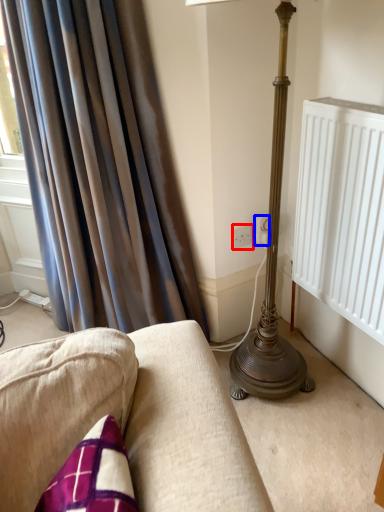
Question: Which point is further to the camera, electric outlet (highlighted by a red box) or electric outlet (highlighted by a blue box)?

Choices:
 (A) electric outlet
 (B) electric outlet

Answer: (A)